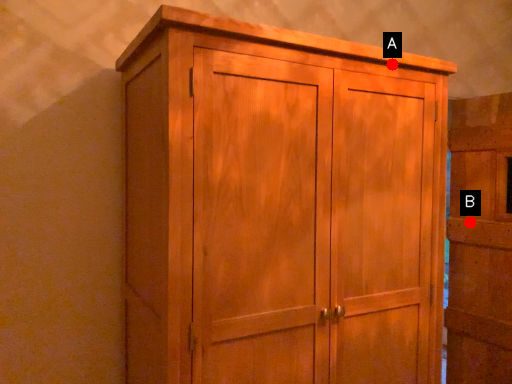
Question: Two points are circled on the image, labeled by A and B beside each circle. Which point appears farthest from the camera in this image?

Choices:
 (A) A is further
 (B) B is further

Answer: (B)